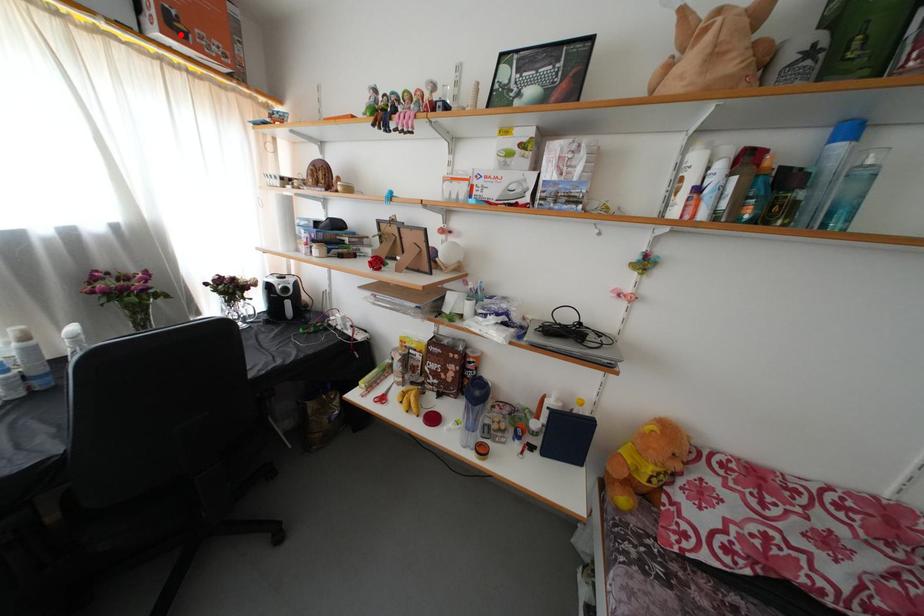
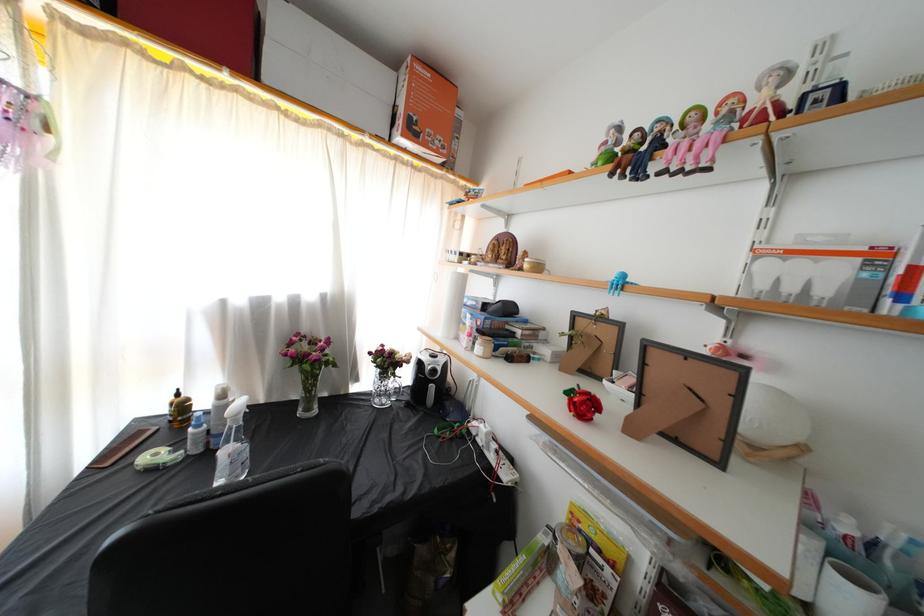
Question: I am providing you with two images of the same scene from different viewpoints. Given a red point in image1, look at the same physical point in image2. Is it:

Choices:
 (A) Closer to the viewpoint
 (B) Farther from the viewpoint

Answer: (A)